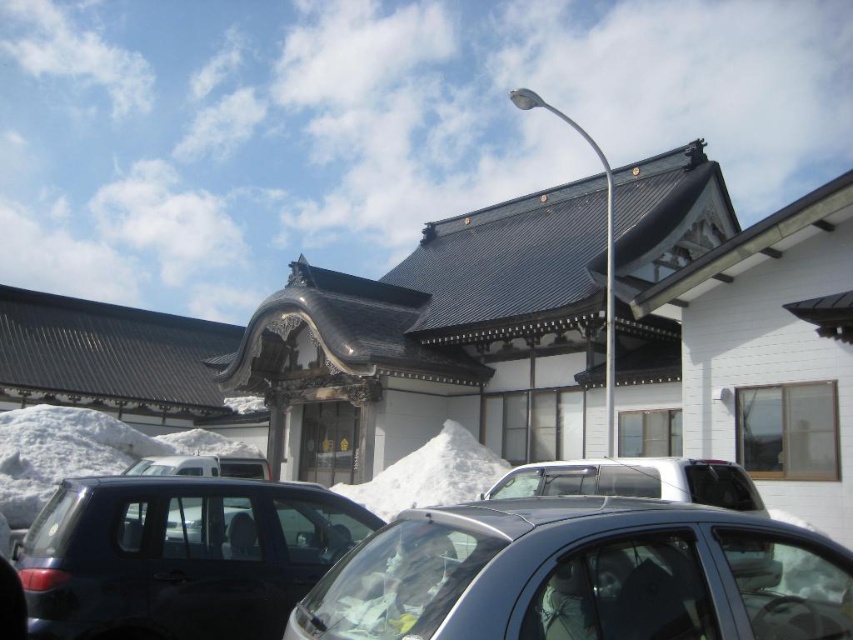
Question: Estimate the real-world distances between objects in this image. Which object is closer to the satin black car at center?

Choices:
 (A) satin black suv at lower left
 (B) white fluffy snow at center
 (C) satin silver car at center

Answer: (C)

Question: Does satin black car at center appear under satin black suv at lower left?

Choices:
 (A) no
 (B) yes

Answer: (B)

Question: Which object appears farthest from the camera in this image?

Choices:
 (A) white fluffy snow at center
 (B) satin black suv at lower left
 (C) satin black car at center
 (D) satin silver car at center

Answer: (A)

Question: Which of the following is the closest to the observer?

Choices:
 (A) white fluffy snow at center
 (B) satin silver car at center

Answer: (B)

Question: Is satin black suv at lower left below white fluffy snow at center?

Choices:
 (A) no
 (B) yes

Answer: (A)

Question: Is satin black car at center bigger than satin silver car at center?

Choices:
 (A) no
 (B) yes

Answer: (B)